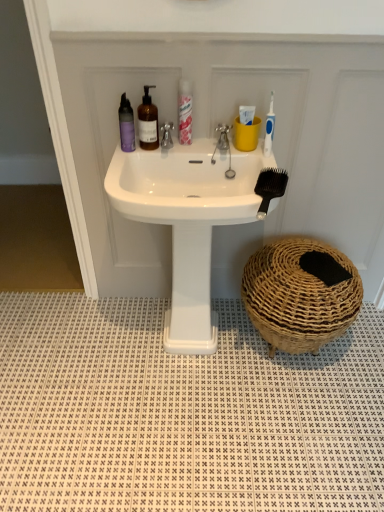
Question: Relative to brown woven basket at lower right, is white textured tile at lower center in front or behind?

Choices:
 (A) front
 (B) behind

Answer: (A)

Question: In terms of height, does white textured tile at lower center look taller or shorter compared to brown woven basket at lower right?

Choices:
 (A) short
 (B) tall

Answer: (A)

Question: Based on their relative distances, which object is nearer to the blue plastic toothbrush at upper right?

Choices:
 (A) metallic silver faucet at center, the second tap in the left-to-right sequence
 (B) black plastic brush at center
 (C) purple matte bottle at upper left, the 2th mouthwash viewed from the right
 (D) metallic silver faucet at center, placed as the 2th tap when sorted from right to left
 (E) translucent pink spray can at upper center

Answer: (A)

Question: Based on their relative distances, which object is farther from the white glossy sink at center?

Choices:
 (A) brown woven basket at lower right
 (B) black plastic brush at center
 (C) white textured tile at lower center
 (D) purple matte bottle at upper left, which is the first mouthwash in left-to-right order
 (E) translucent pink spray can at upper center

Answer: (C)